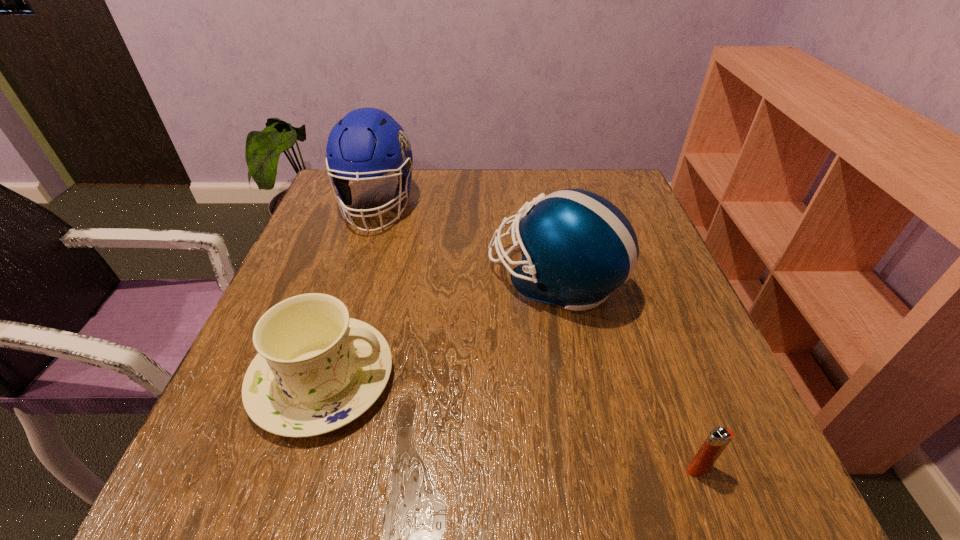
Locate an element on the screen. This screenshot has width=960, height=540. object that is at the far left corner is located at coordinates [367, 143].

This screenshot has height=540, width=960. Identify the location of object that is at the near right corner. (718, 439).

The width and height of the screenshot is (960, 540). In the image, there is a desktop. What are the coordinates of `blank space at the near edge` in the screenshot? It's located at (384, 469).

What are the coordinates of `vacant space at the left edge of the desktop` in the screenshot? It's located at (280, 287).

Where is `free space at the right edge of the desktop`? This screenshot has width=960, height=540. free space at the right edge of the desktop is located at coordinates (676, 277).

I want to click on free space at the far left corner of the desktop, so click(x=353, y=193).

Identify the location of vacant space at the far right corner. The image size is (960, 540). (582, 173).

The height and width of the screenshot is (540, 960). I want to click on empty space that is in between the third object from left to right and the second shortest object, so click(439, 329).

Identify the location of vacant space in between the nearer football helmet and the farther football helmet. This screenshot has height=540, width=960. (466, 242).

Identify the location of vacant area that lies between the farthest object and the second nearest object. (349, 292).